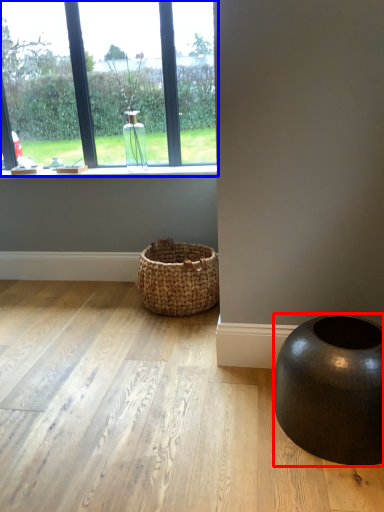
Question: Which point is closer to the camera, oval (highlighted by a red box) or window (highlighted by a blue box)?

Choices:
 (A) oval
 (B) window

Answer: (A)